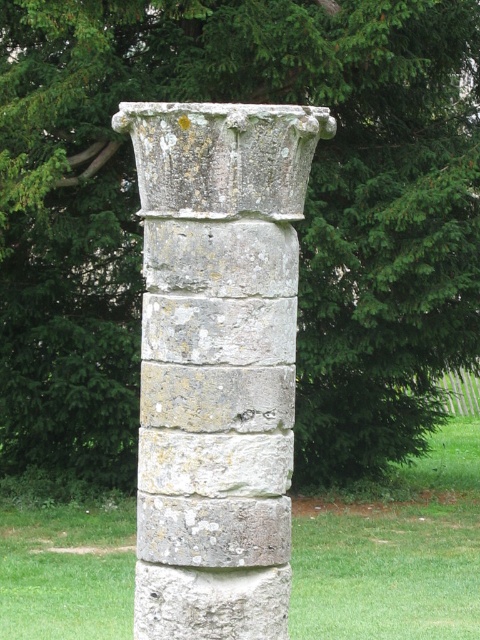
Question: Can you confirm if weathered stone column at center is wider than green grass at center?

Choices:
 (A) yes
 (B) no

Answer: (B)

Question: Which point is closer to the camera taking this photo?

Choices:
 (A) (103, 564)
 (B) (200, 172)

Answer: (B)

Question: Which point is closer to the camera?

Choices:
 (A) green grass at center
 (B) weathered stone column at center

Answer: (B)

Question: Does weathered stone column at center have a larger size compared to green grass at center?

Choices:
 (A) yes
 (B) no

Answer: (B)

Question: Can you confirm if weathered stone column at center is positioned to the right of green grass at center?

Choices:
 (A) no
 (B) yes

Answer: (A)

Question: Which point is closer to the camera taking this photo?

Choices:
 (A) (29, 605)
 (B) (166, 360)

Answer: (B)